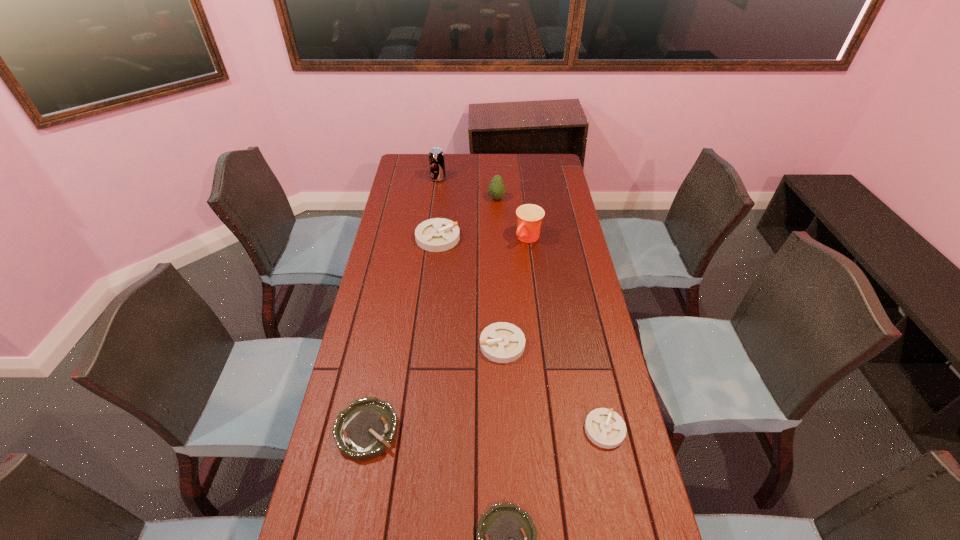
Identify which object is the third nearest to the cup. Please provide its 2D coordinates. Your answer should be formatted as a tuple, i.e. [(x, y)], where the tuple contains the x and y coordinates of a point satisfying the conditions above.

[(501, 342)]

Choose which object is the sixth nearest neighbor to the second smallest gray ashtray. Please provide its 2D coordinates. Your answer should be formatted as a tuple, i.e. [(x, y)], where the tuple contains the x and y coordinates of a point satisfying the conditions above.

[(496, 189)]

Choose which ashtray is the second nearest neighbor to the second biggest gray ashtray. Please provide its 2D coordinates. Your answer should be formatted as a tuple, i.e. [(x, y)], where the tuple contains the x and y coordinates of a point satisfying the conditions above.

[(368, 427)]

This screenshot has height=540, width=960. Find the location of `the third closest ashtray to the smallest gray ashtray`. the third closest ashtray to the smallest gray ashtray is located at coordinates (368, 427).

Point out which gray ashtray is positioned as the nearest to the second gray ashtray from left to right. Please provide its 2D coordinates. Your answer should be formatted as a tuple, i.e. [(x, y)], where the tuple contains the x and y coordinates of a point satisfying the conditions above.

[(605, 428)]

At what (x,y) coordinates should I click in order to perform the action: click on gray ashtray that is the second nearest to the rightmost gray ashtray. Please return your answer as a coordinate pair (x, y). The image size is (960, 540). Looking at the image, I should click on (438, 234).

Identify which green ashtray is located as the second nearest to the farthest object. Please provide its 2D coordinates. Your answer should be formatted as a tuple, i.e. [(x, y)], where the tuple contains the x and y coordinates of a point satisfying the conditions above.

[(506, 536)]

Point out which green ashtray is positioned as the second nearest to the leftmost gray ashtray. Please provide its 2D coordinates. Your answer should be formatted as a tuple, i.e. [(x, y)], where the tuple contains the x and y coordinates of a point satisfying the conditions above.

[(506, 536)]

What are the coordinates of `free space that satisfies the following two spatial constraints: 1. on the back side of the fourth nearest object; 2. on the left side of the cup` in the screenshot? It's located at (497, 239).